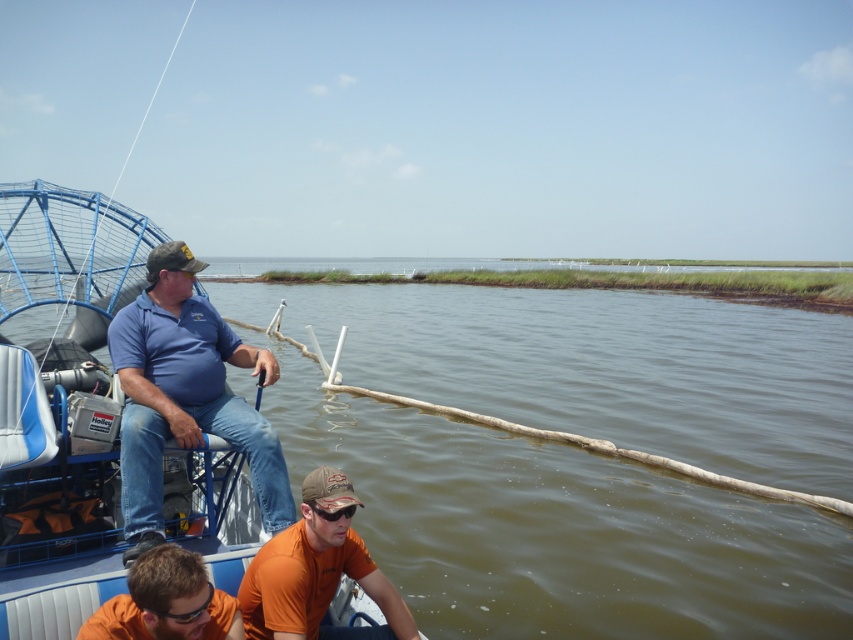
You are a photographer trying to capture the orange cotton shirt at lower center and the brown murky water at center in the same frame. Considering their sizes, which object should you focus on first to ensure both are in the frame?

The brown murky water at center has a larger size compared to orange cotton shirt at lower center, so you should focus on the brown murky water at center first to ensure both are in the frame.